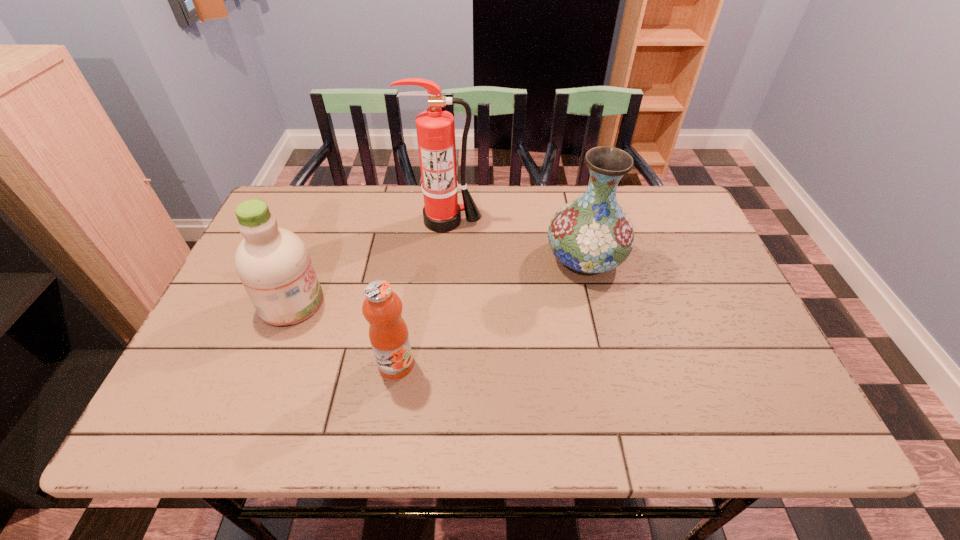
This screenshot has height=540, width=960. Find the location of `the tallest object`. the tallest object is located at coordinates (435, 127).

The width and height of the screenshot is (960, 540). In order to click on vase in this screenshot , I will do `click(592, 234)`.

The image size is (960, 540). Find the location of `cleansing agent`. cleansing agent is located at coordinates (273, 264).

The image size is (960, 540). What are the coordinates of `the nearest object` in the screenshot? It's located at (382, 308).

Locate an element on the screen. This screenshot has height=540, width=960. the shortest object is located at coordinates (382, 308).

At what (x,y) coordinates should I click in order to perform the action: click on vacant space situated at the nozzle of the fire extinguisher. Please return your answer as a coordinate pair (x, y). Looking at the image, I should click on (437, 317).

Where is `free region located 0.180m on the left of the vase`? The image size is (960, 540). free region located 0.180m on the left of the vase is located at coordinates (478, 259).

Identify the location of free space located 0.190m on the front label of the cleansing agent. (400, 303).

Where is `vacant space situated on the front label of the fruit juice`? The height and width of the screenshot is (540, 960). vacant space situated on the front label of the fruit juice is located at coordinates (388, 420).

Identify the location of fire extinguisher positioned at the far edge. The width and height of the screenshot is (960, 540). (435, 127).